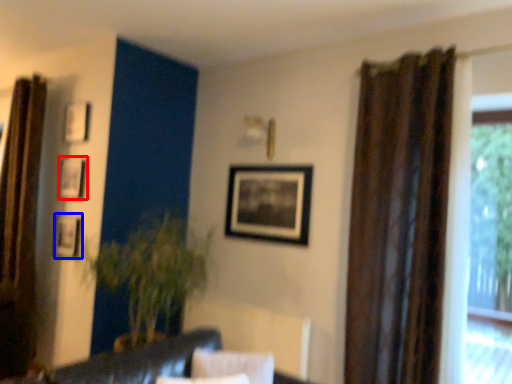
Question: Which of the following is the closest to the observer, picture frame (highlighted by a red box) or picture frame (highlighted by a blue box)?

Choices:
 (A) picture frame
 (B) picture frame

Answer: (B)